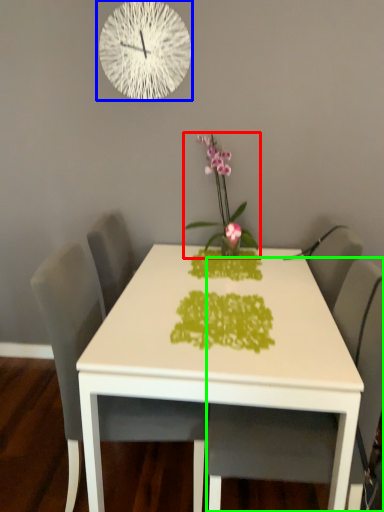
Question: Which object is the closest to the houseplant (highlighted by a red box)? Choose among these: wall clock (highlighted by a blue box) or chair (highlighted by a green box).

Choices:
 (A) wall clock
 (B) chair

Answer: (A)